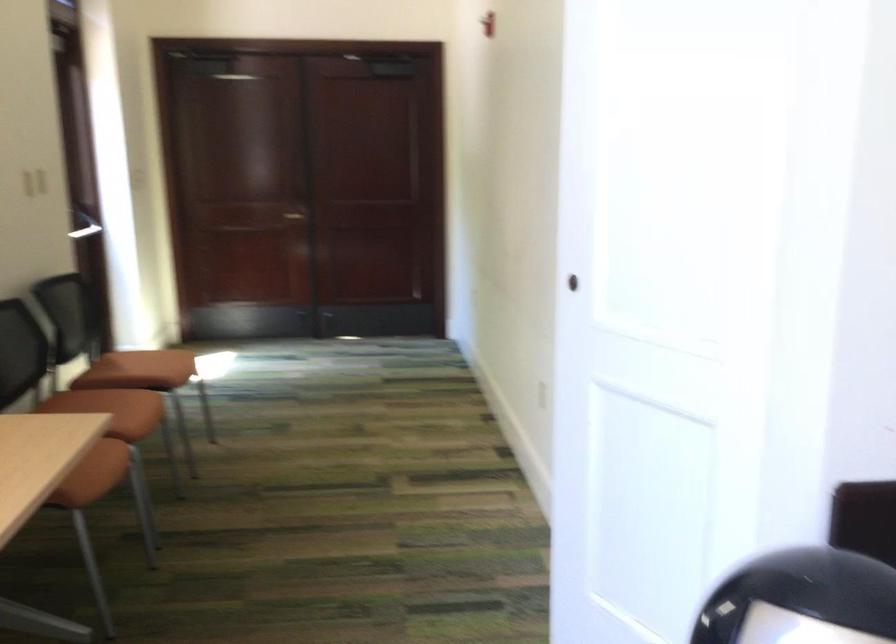
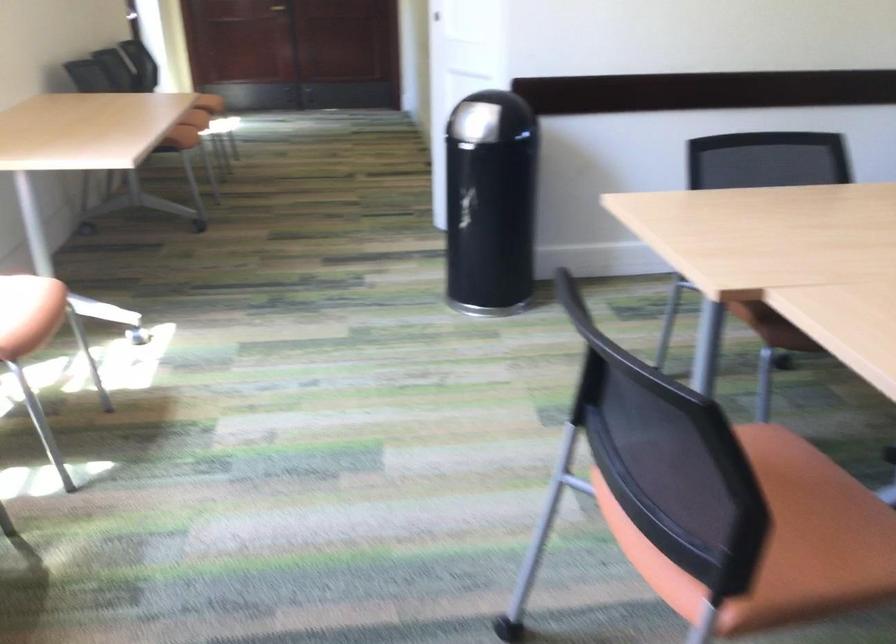
Question: I am providing you with two images of the same scene from different viewpoints. After the viewpoint changes to image2, which objects are now occluded?

Choices:
 (A) orange chair sitting surface
 (B) chair sitting surface
 (C) round white pillow
 (D) trash can lid

Answer: (B)